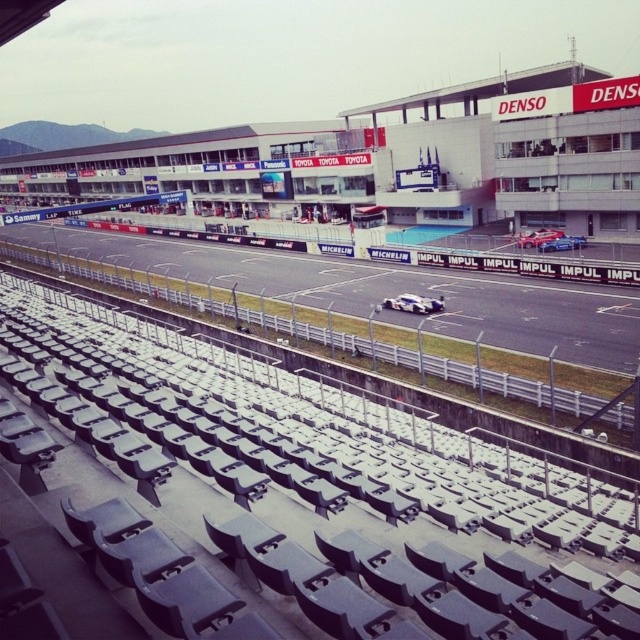
Question: Which point appears farthest from the camera in this image?

Choices:
 (A) (564, 243)
 (B) (570, 240)
 (C) (308, 276)
 (D) (422, 298)

Answer: (C)

Question: Which point is closer to the camera taking this photo?

Choices:
 (A) (582, 244)
 (B) (410, 298)
 (C) (548, 237)

Answer: (B)

Question: Does black asphalt race track at center have a greater width compared to blue metallic car at center?

Choices:
 (A) yes
 (B) no

Answer: (A)

Question: Which point is farther to the camera?

Choices:
 (A) black asphalt race track at center
 (B) white matte race car at center

Answer: (B)

Question: Is black asphalt race track at center to the right of blue metallic car at center from the viewer's perspective?

Choices:
 (A) no
 (B) yes

Answer: (A)

Question: Does black asphalt race track at center appear under white matte race car at center?

Choices:
 (A) yes
 (B) no

Answer: (B)